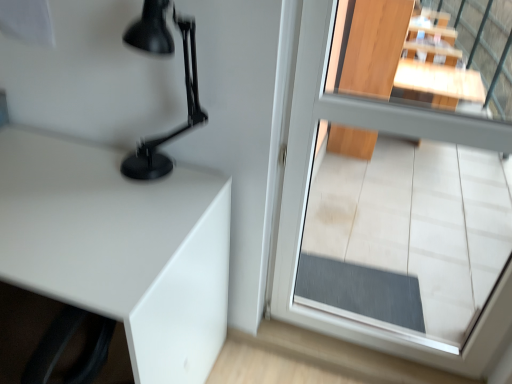
Question: Would you say transparent glass door at center is to the left or to the right of white glossy table at left in the picture?

Choices:
 (A) right
 (B) left

Answer: (A)

Question: From a real-world perspective, relative to white glossy table at left, is transparent glass door at center vertically above or below?

Choices:
 (A) below
 (B) above

Answer: (B)

Question: Which object is positioned closest to the transparent glass door at center?

Choices:
 (A) white glossy table at left
 (B) matte black lamp at upper left

Answer: (B)

Question: Considering the real-world distances, which object is closest to the white glossy table at left?

Choices:
 (A) transparent glass door at center
 (B) matte black lamp at upper left

Answer: (B)